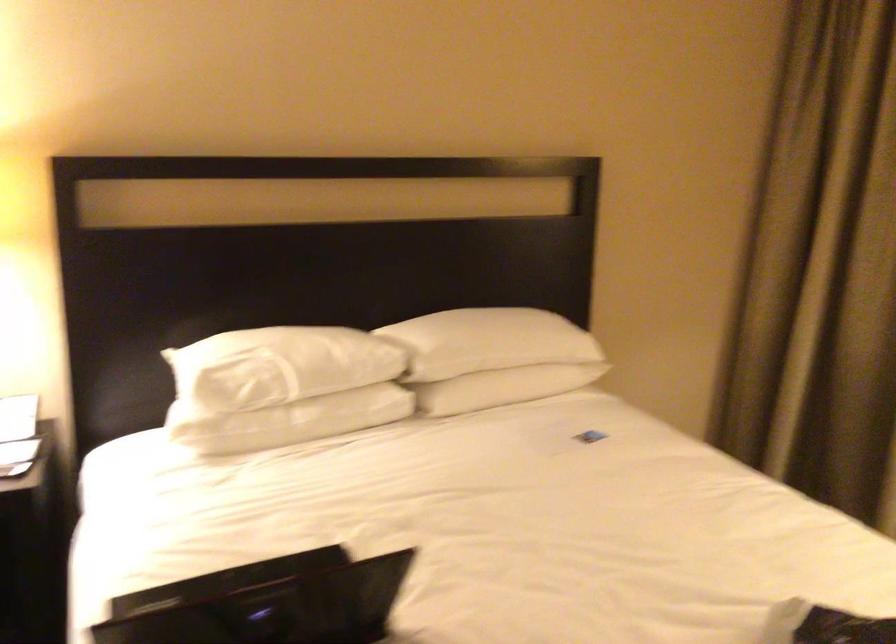
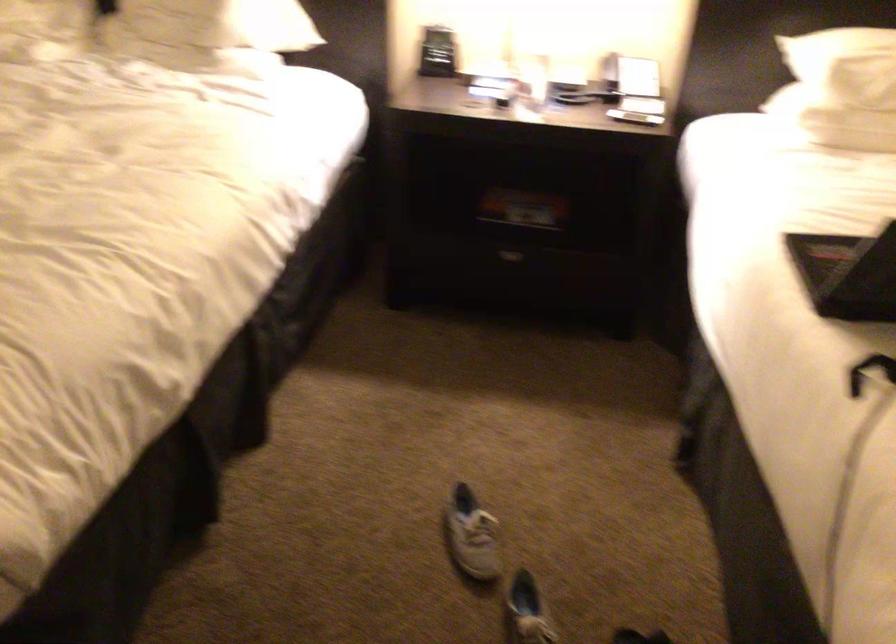
Find the pixel in the second image that matches (x=227, y=408) in the first image.

(858, 95)